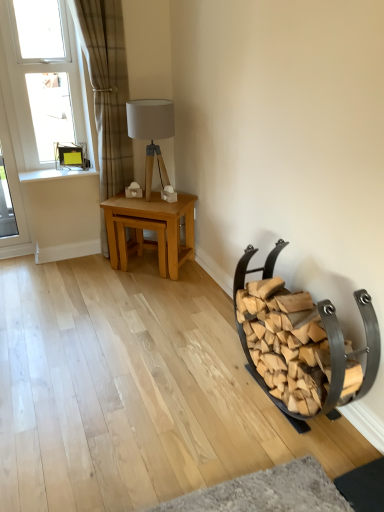
Locate an element on the screen. The image size is (384, 512). unoccupied area in front of light oak table at center is located at coordinates (153, 295).